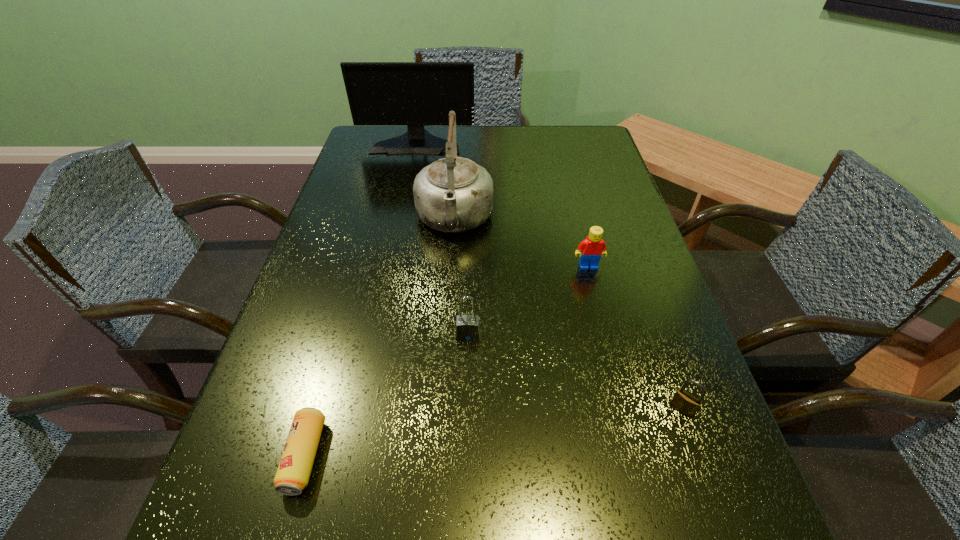
At what (x,y) coordinates should I click in order to perform the action: click on free space in the image that satisfies the following two spatial constraints: 1. on the back side of the right padlock; 2. on the left side of the nearest object. Please return your answer as a coordinate pair (x, y). The height and width of the screenshot is (540, 960). Looking at the image, I should click on (319, 409).